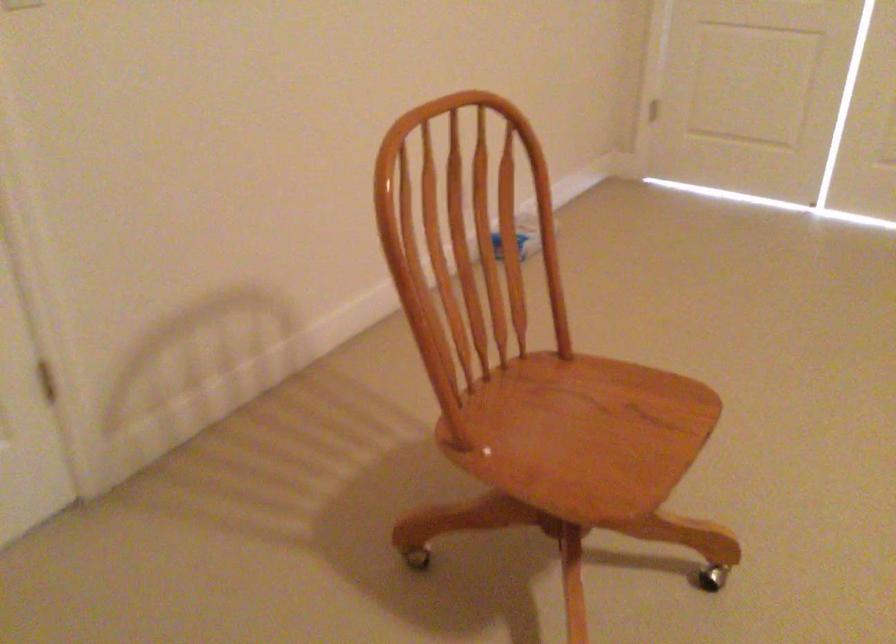
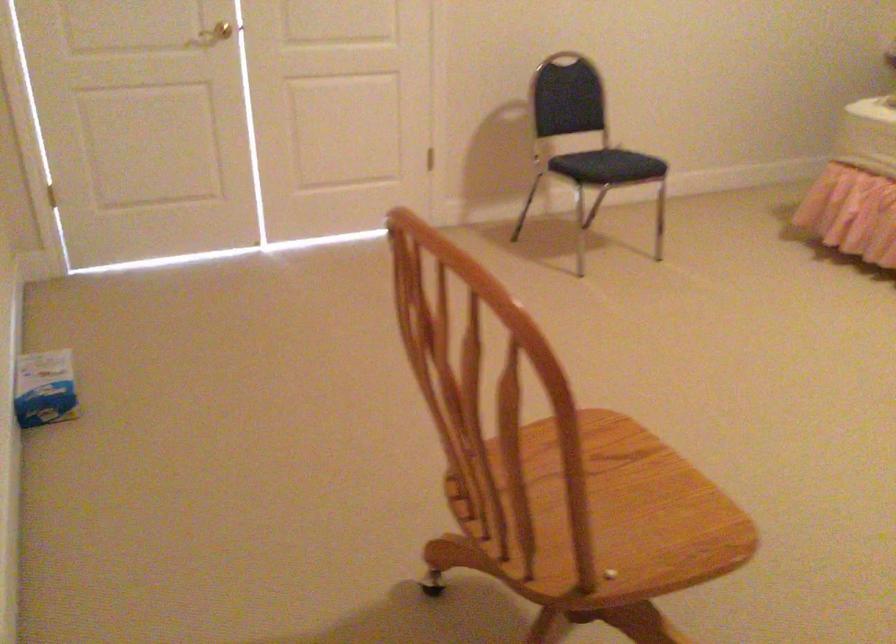
Find the pixel in the second image that matches the point at 590,460 in the first image.

(613, 509)